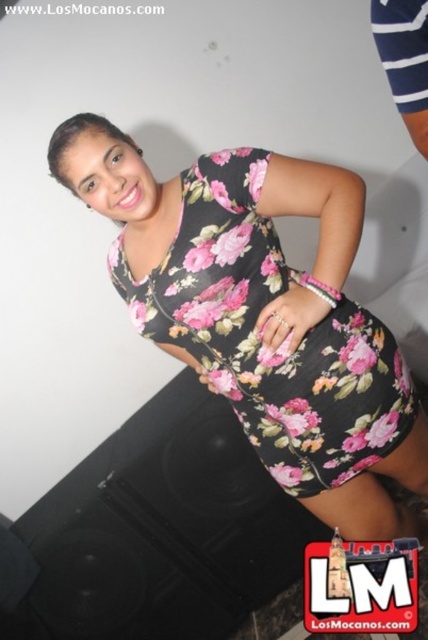
Question: Which point is farther from the camera taking this photo?

Choices:
 (A) (187, 342)
 (B) (427, 3)

Answer: (A)

Question: Among these objects, which one is farthest from the camera?

Choices:
 (A) white striped fabric at upper right
 (B) floral print fabric dress at center

Answer: (B)

Question: Does floral print fabric dress at center have a smaller size compared to white striped fabric at upper right?

Choices:
 (A) no
 (B) yes

Answer: (A)

Question: Is floral print fabric dress at center thinner than white striped fabric at upper right?

Choices:
 (A) yes
 (B) no

Answer: (B)

Question: Among these points, which one is farthest from the camera?

Choices:
 (A) (270, 385)
 (B) (416, 109)

Answer: (A)

Question: Is floral print fabric dress at center behind white striped fabric at upper right?

Choices:
 (A) no
 (B) yes

Answer: (B)